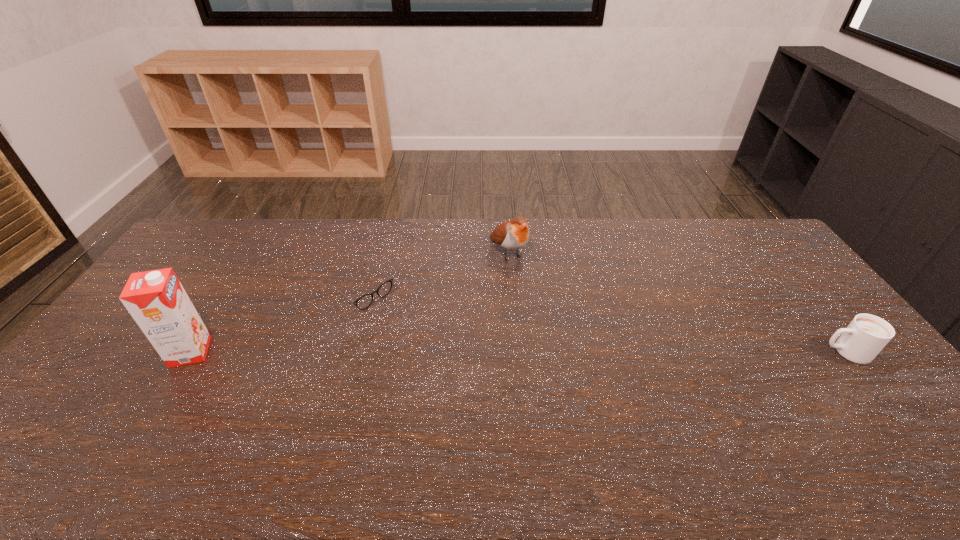
The height and width of the screenshot is (540, 960). Find the location of `free space located on the side with the handle of the rightmost object`. free space located on the side with the handle of the rightmost object is located at coordinates (695, 352).

What are the coordinates of `vacant space situated 0.250m on the side with the handle of the rightmost object` in the screenshot? It's located at (733, 352).

At what (x,y) coordinates should I click in order to perform the action: click on vacant space located through the lenses of the third object from right to left. Please return your answer as a coordinate pair (x, y). The height and width of the screenshot is (540, 960). Looking at the image, I should click on 425,339.

Where is `free space located through the lenses of the third object from right to left`? This screenshot has width=960, height=540. free space located through the lenses of the third object from right to left is located at coordinates (432, 344).

Find the location of a particular element. The width and height of the screenshot is (960, 540). free space located through the lenses of the third object from right to left is located at coordinates (419, 333).

The width and height of the screenshot is (960, 540). In order to click on free location located 0.080m at the face of the second object from right to left in this screenshot , I will do `click(530, 284)`.

The height and width of the screenshot is (540, 960). Find the location of `vacant space located 0.400m at the face of the second object from right to left`. vacant space located 0.400m at the face of the second object from right to left is located at coordinates (588, 350).

Locate an element on the screen. The width and height of the screenshot is (960, 540). vacant region located 0.320m at the face of the second object from right to left is located at coordinates (572, 332).

I want to click on object that is at the far edge, so click(x=512, y=235).

Where is `object present at the right edge`? object present at the right edge is located at coordinates (863, 339).